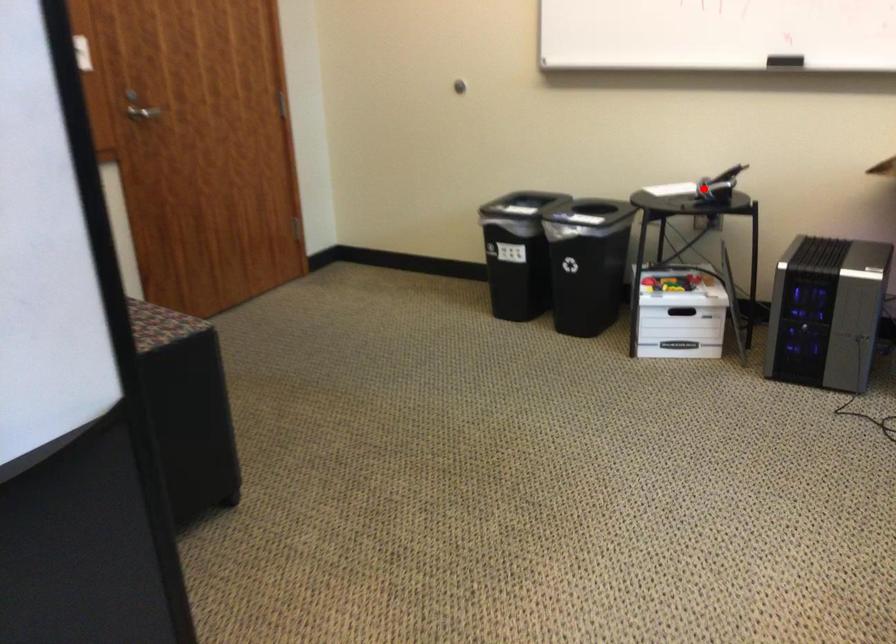
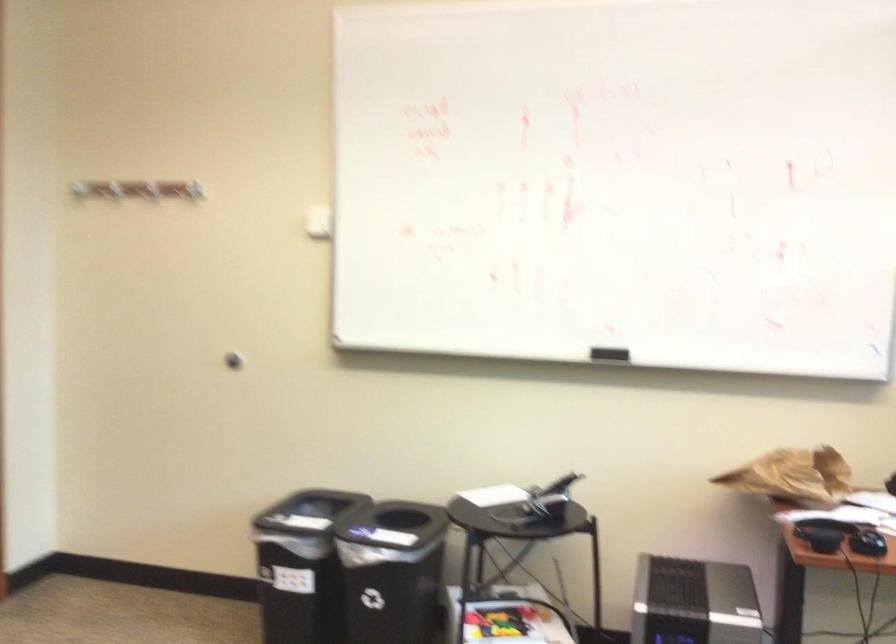
Question: A red point is marked in image1. In image2, is the corresponding 3D point closer to the camera or farther? Reply with the corresponding letter.

Choices:
 (A) The corresponding 3D point is closer.
 (B) The corresponding 3D point is farther.

Answer: (A)